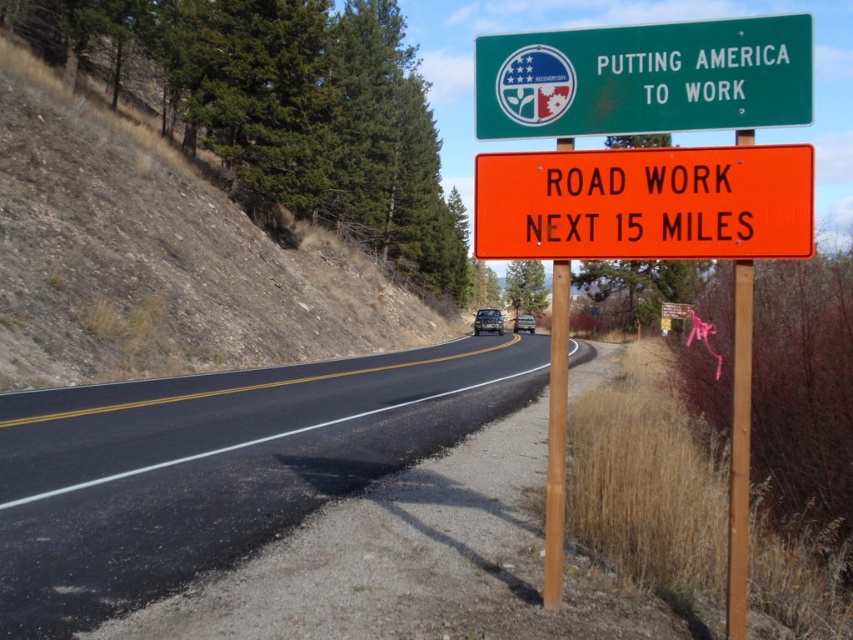
Question: Can you confirm if orange reflective plastic sign at right is positioned above green metallic sign at upper center?

Choices:
 (A) yes
 (B) no

Answer: (B)

Question: Does black asphalt road at center come in front of green metallic sign at upper center?

Choices:
 (A) no
 (B) yes

Answer: (A)

Question: Among these objects, which one is nearest to the camera?

Choices:
 (A) green metallic sign at upper center
 (B) black asphalt road at center
 (C) orange reflective plastic sign at right

Answer: (C)

Question: Considering the relative positions of orange reflective plastic sign at right and green metallic sign at upper center in the image provided, where is orange reflective plastic sign at right located with respect to green metallic sign at upper center?

Choices:
 (A) below
 (B) above

Answer: (A)

Question: Among these objects, which one is nearest to the camera?

Choices:
 (A) black asphalt road at center
 (B) orange reflective plastic sign at right
 (C) green metallic sign at upper center

Answer: (B)

Question: Which of the following is the farthest from the observer?

Choices:
 (A) black asphalt road at center
 (B) orange reflective plastic sign at right

Answer: (A)